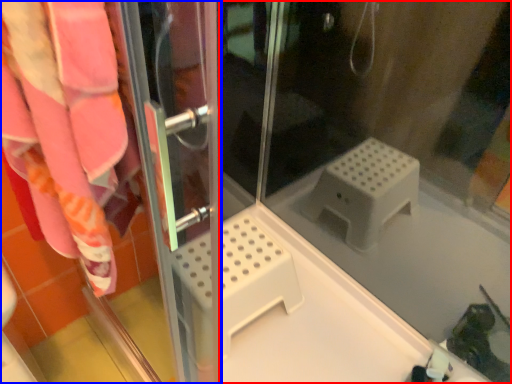
Question: Which object is closer to the camera taking this photo, glass door (highlighted by a red box) or screen door (highlighted by a blue box)?

Choices:
 (A) glass door
 (B) screen door

Answer: (B)